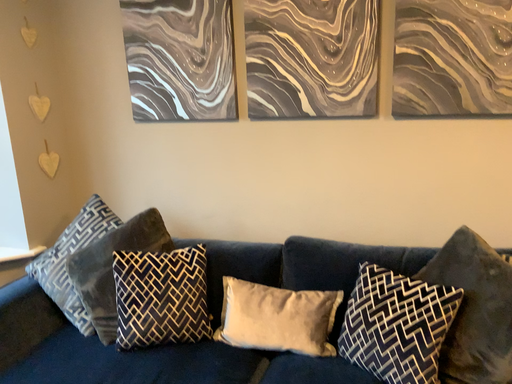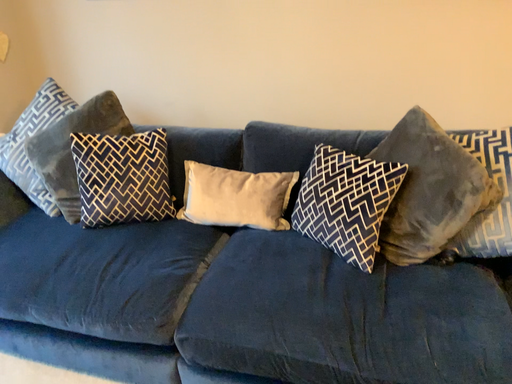
Question: How did the camera likely rotate when shooting the video?

Choices:
 (A) rotated upward
 (B) rotated downward

Answer: (B)